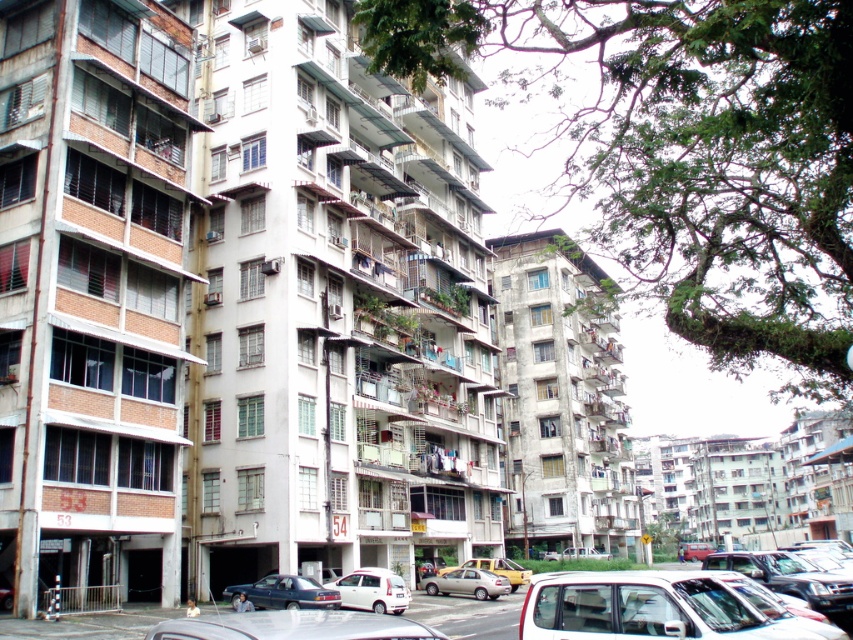
Is point (320, 588) positioned behind point (479, 557)?

No, it is not.

Can you confirm if dark blue metallic car at lower center is positioned to the left of yellow matte taxi at center?

Yes, dark blue metallic car at lower center is to the left of yellow matte taxi at center.

The height and width of the screenshot is (640, 853). I want to click on dark blue metallic car at lower center, so click(x=283, y=593).

Does white matte car at lower right appear over yellow matte taxi at center?

Yes.

Is white matte car at lower right positioned behind yellow matte taxi at center?

No.

The image size is (853, 640). In order to click on white matte car at lower right in this screenshot , I will do `click(651, 609)`.

Where is `dark blue metallic car at lower center`? Image resolution: width=853 pixels, height=640 pixels. dark blue metallic car at lower center is located at coordinates (283, 593).

Is dark blue metallic car at lower center further to camera compared to white matte pickup truck at center?

No, dark blue metallic car at lower center is in front of white matte pickup truck at center.

This screenshot has height=640, width=853. What do you see at coordinates (283, 593) in the screenshot?
I see `dark blue metallic car at lower center` at bounding box center [283, 593].

Where is `dark blue metallic car at lower center`? Image resolution: width=853 pixels, height=640 pixels. dark blue metallic car at lower center is located at coordinates (283, 593).